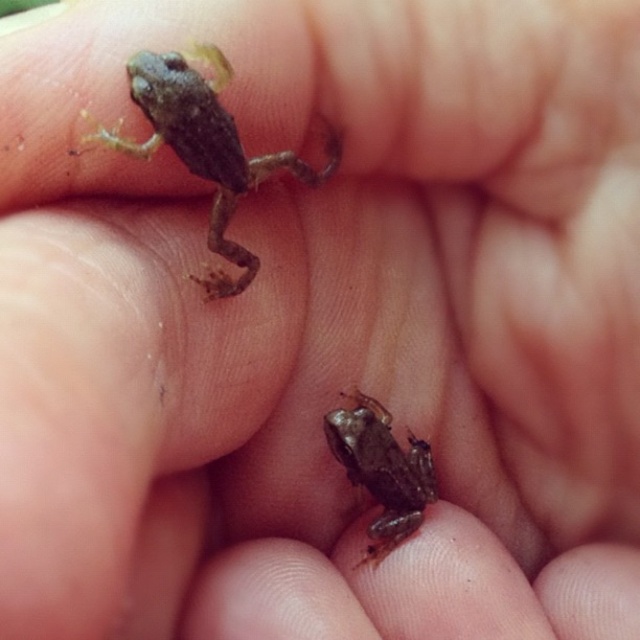
Question: Does smooth brown frog at upper left have a lesser width compared to brown matte frog at lower center?

Choices:
 (A) no
 (B) yes

Answer: (A)

Question: Can you confirm if smooth brown frog at upper left is positioned below brown matte frog at lower center?

Choices:
 (A) no
 (B) yes

Answer: (A)

Question: Among these objects, which one is nearest to the camera?

Choices:
 (A) smooth brown frog at upper left
 (B) brown matte frog at lower center

Answer: (A)

Question: Can you confirm if smooth brown frog at upper left is positioned below brown matte frog at lower center?

Choices:
 (A) yes
 (B) no

Answer: (B)

Question: Which of the following is the closest to the observer?

Choices:
 (A) smooth brown frog at upper left
 (B) brown matte frog at lower center

Answer: (A)